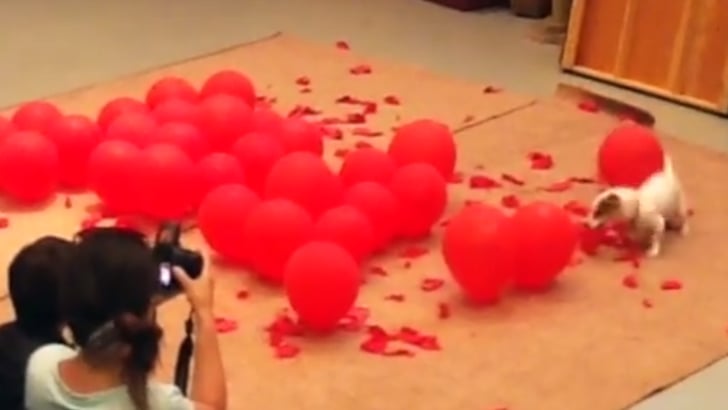
At what (x,y) coordinates should I click in order to perform the action: click on furniture. Please return your answer as a coordinate pair (x, y). Image resolution: width=728 pixels, height=410 pixels. Looking at the image, I should click on (x=600, y=44).